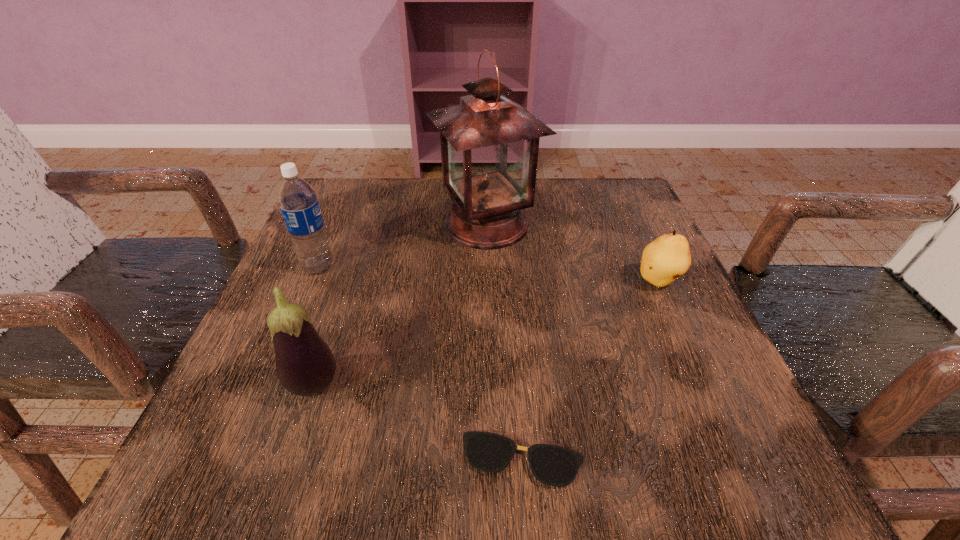
Image resolution: width=960 pixels, height=540 pixels. I want to click on vacant space at the left edge of the desktop, so click(374, 240).

You are a GUI agent. You are given a task and a screenshot of the screen. Output one action in this format:
    pyautogui.click(x=<x>, y=<y>)
    Task: Click on the vacant space at the right edge of the desktop
    This screenshot has height=540, width=960.
    Given the screenshot: What is the action you would take?
    pyautogui.click(x=604, y=277)

Where is `vacant area at the far right corner`? Image resolution: width=960 pixels, height=540 pixels. vacant area at the far right corner is located at coordinates (588, 180).

Locate an element on the screen. free space at the near right corner of the desktop is located at coordinates (651, 429).

What are the coordinates of `free space between the nearest object and the leftmost object` in the screenshot? It's located at pyautogui.click(x=420, y=363).

Image resolution: width=960 pixels, height=540 pixels. Identify the location of free point between the rightmost object and the water bottle. (489, 274).

Image resolution: width=960 pixels, height=540 pixels. I want to click on vacant area between the tallest object and the spectacles, so click(x=505, y=342).

You are a GUI agent. You are given a task and a screenshot of the screen. Output one action in this format:
    pyautogui.click(x=<x>, y=<y>)
    Task: Click on the vacant space in between the leftmost object and the tallest object
    
    Given the screenshot: What is the action you would take?
    pyautogui.click(x=402, y=246)

Find the location of a particular element. This screenshot has width=960, height=540. vacant space that is in between the oil lamp and the leftmost object is located at coordinates (402, 246).

Locate an element on the screen. blank region between the leftmost object and the tallest object is located at coordinates (402, 246).